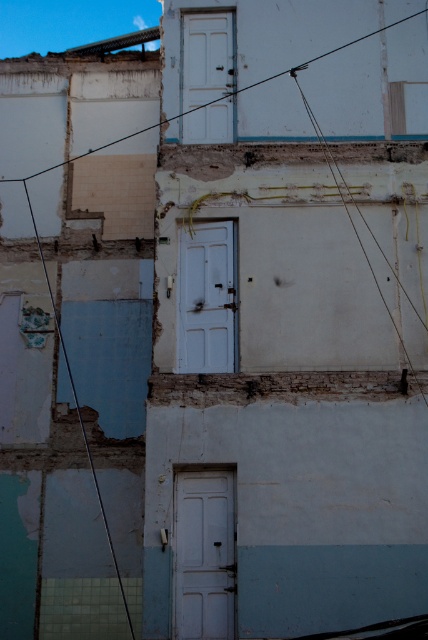
Measure the distance between smooth wire at upper center and camera.

smooth wire at upper center is 50.74 feet from camera.

Is smooth wire at upper center positioned behind rusty wire at left?

Yes, smooth wire at upper center is behind rusty wire at left.

Who is more distant from viewer, (419, 12) or (124, 595)?

Positioned behind is point (419, 12).

You are a GUI agent. You are given a task and a screenshot of the screen. Output one action in this format:
    pyautogui.click(x=<x>, y=<y>)
    Task: Click on the smooth wire at upper center
    The width and height of the screenshot is (428, 640).
    Given the screenshot: What is the action you would take?
    pyautogui.click(x=79, y=156)

In the scene shown: Does smooth wire at upper center have a greater height compared to rusty wire at right?

Indeed, smooth wire at upper center has a greater height compared to rusty wire at right.

Which of these two, smooth wire at upper center or rusty wire at right, stands taller?

smooth wire at upper center is taller.

Who is more forward, (353, 42) or (309, 109)?

Point (309, 109) is more forward.

Where is `smooth wire at upper center`? This screenshot has width=428, height=640. smooth wire at upper center is located at coordinates (79, 156).

Who is more distant from viewer, [106,525] or [312,115]?

Positioned behind is point [106,525].

Between rusty wire at left and rusty wire at right, which one appears on the left side from the viewer's perspective?

Positioned to the left is rusty wire at left.

Between point (64, 355) and point (303, 92), which one is positioned in front?

Positioned in front is point (303, 92).

The height and width of the screenshot is (640, 428). In order to click on rusty wire at left in this screenshot , I will do `click(79, 412)`.